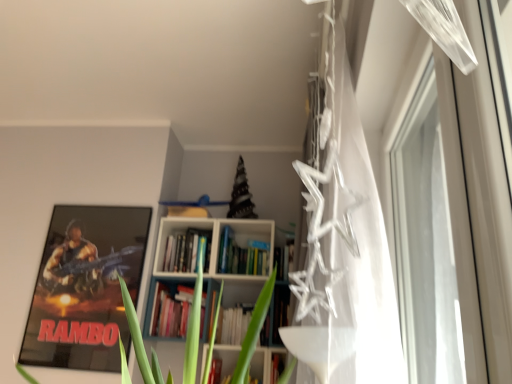
Image resolution: width=512 pixels, height=384 pixels. Find the location of `blank space situated above metallic rambo poster at left (from a real-world perspective)`. blank space situated above metallic rambo poster at left (from a real-world perspective) is located at coordinates (96, 199).